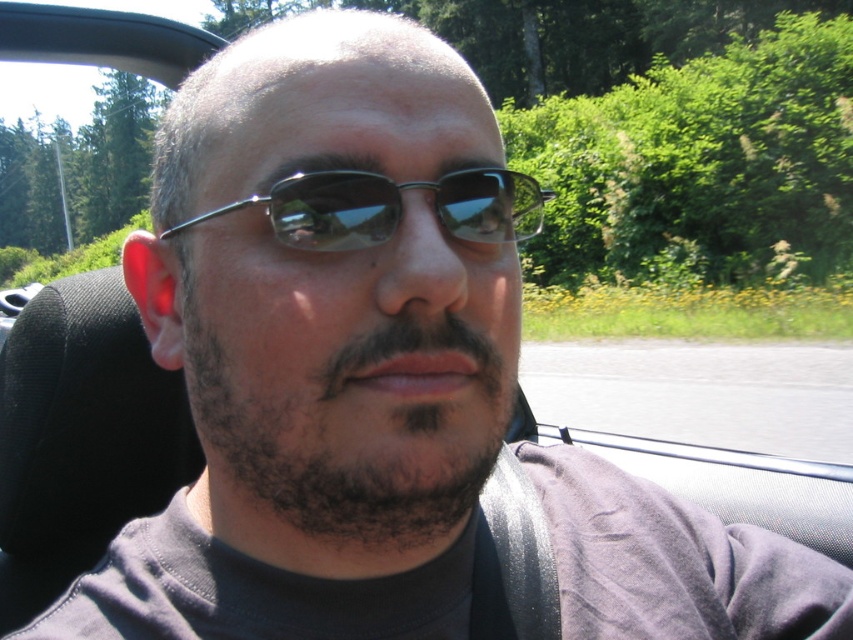
Question: Can you confirm if dark brown fuzzy beard at center is positioned to the left of metallic frame sunglasses at center?

Choices:
 (A) no
 (B) yes

Answer: (B)

Question: Is dark brown fuzzy beard at center to the left of metallic frame sunglasses at center from the viewer's perspective?

Choices:
 (A) no
 (B) yes

Answer: (B)

Question: Among these points, which one is farthest from the camera?

Choices:
 (A) (451, 186)
 (B) (381, 472)

Answer: (A)

Question: Can you confirm if dark brown fuzzy beard at center is wider than metallic frame sunglasses at center?

Choices:
 (A) no
 (B) yes

Answer: (A)